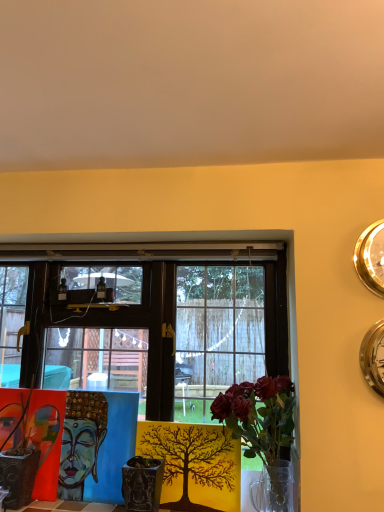
Question: From their relative heights in the image, would you say gold metallic clock at upper right, which is the second clock in bottom-to-top order, is taller or shorter than wooden table at center?

Choices:
 (A) short
 (B) tall

Answer: (A)

Question: Is gold metallic clock at upper right, placed as the first clock when sorted from top to bottom, inside the boundaries of wooden table at center, or outside?

Choices:
 (A) inside
 (B) outside

Answer: (B)

Question: Which is farther from the textured ceramic pot at center?

Choices:
 (A) wooden table at center
 (B) translucent glass vase at center
 (C) translucent glass vase at center
 (D) gold metallic clock at upper right, which is the second clock in bottom-to-top order
 (E) silver metallic clock at upper right, which is the first clock in bottom-to-top order

Answer: (D)

Question: Estimate the real-world distances between objects in this image. Which object is closer to the translucent glass vase at center?

Choices:
 (A) gold metallic clock at upper right, which is the second clock in bottom-to-top order
 (B) translucent glass vase at center
 (C) wooden table at center
 (D) textured ceramic pot at center
 (E) silver metallic clock at upper right, which is the first clock in bottom-to-top order

Answer: (B)